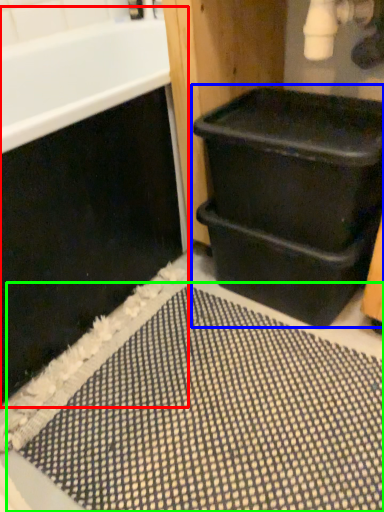
Question: Which is nearer to the bath (highlighted by a red box)? waste container (highlighted by a blue box) or bath mat (highlighted by a green box).

Choices:
 (A) waste container
 (B) bath mat

Answer: (A)